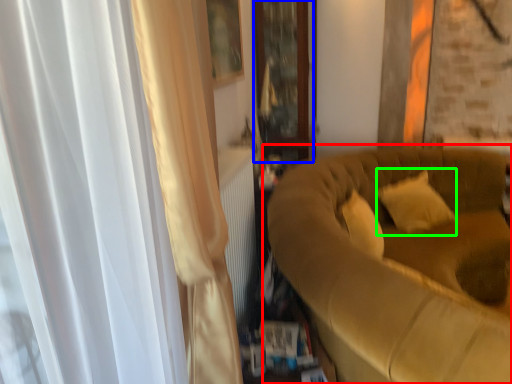
Question: Which object is the closest to the studio couch (highlighted by a red box)? Choose among these: glass door (highlighted by a blue box) or pillow (highlighted by a green box).

Choices:
 (A) glass door
 (B) pillow

Answer: (B)